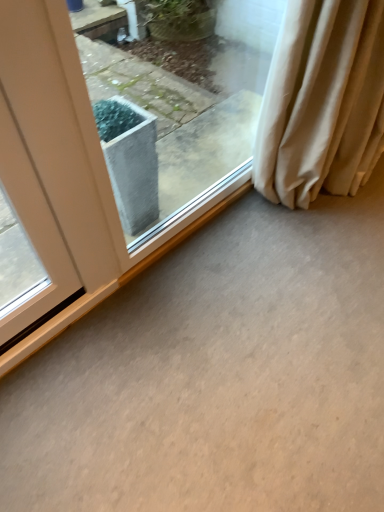
Question: Should I look upward or downward to see transparent glass window at center?

Choices:
 (A) up
 (B) down

Answer: (A)

Question: Is transparent glass window at center touching gray concrete at center?

Choices:
 (A) yes
 (B) no

Answer: (B)

Question: Can you confirm if transparent glass window at center is positioned to the right of gray concrete at center?

Choices:
 (A) no
 (B) yes

Answer: (A)

Question: Considering the relative sizes of transparent glass window at center and gray concrete at center in the image provided, is transparent glass window at center taller than gray concrete at center?

Choices:
 (A) yes
 (B) no

Answer: (A)

Question: Is transparent glass window at center positioned before gray concrete at center?

Choices:
 (A) yes
 (B) no

Answer: (B)

Question: Does transparent glass window at center have a larger size compared to gray concrete at center?

Choices:
 (A) yes
 (B) no

Answer: (B)

Question: Is the position of transparent glass window at center more distant than that of gray concrete at center?

Choices:
 (A) yes
 (B) no

Answer: (A)

Question: From a real-world perspective, is transparent glass window at center beneath beige fabric curtain at right?

Choices:
 (A) no
 (B) yes

Answer: (A)

Question: From the image's perspective, is transparent glass window at center on top of beige fabric curtain at right?

Choices:
 (A) no
 (B) yes

Answer: (A)

Question: Is transparent glass window at center oriented away from beige fabric curtain at right?

Choices:
 (A) yes
 (B) no

Answer: (B)

Question: Considering the relative sizes of transparent glass window at center and beige fabric curtain at right in the image provided, is transparent glass window at center taller than beige fabric curtain at right?

Choices:
 (A) no
 (B) yes

Answer: (B)

Question: From the image's perspective, would you say transparent glass window at center is shown under beige fabric curtain at right?

Choices:
 (A) no
 (B) yes

Answer: (B)

Question: Is the depth of transparent glass window at center less than that of beige fabric curtain at right?

Choices:
 (A) no
 (B) yes

Answer: (B)

Question: Considering the relative sizes of gray concrete at center and transparent glass window at center in the image provided, is gray concrete at center taller than transparent glass window at center?

Choices:
 (A) yes
 (B) no

Answer: (B)